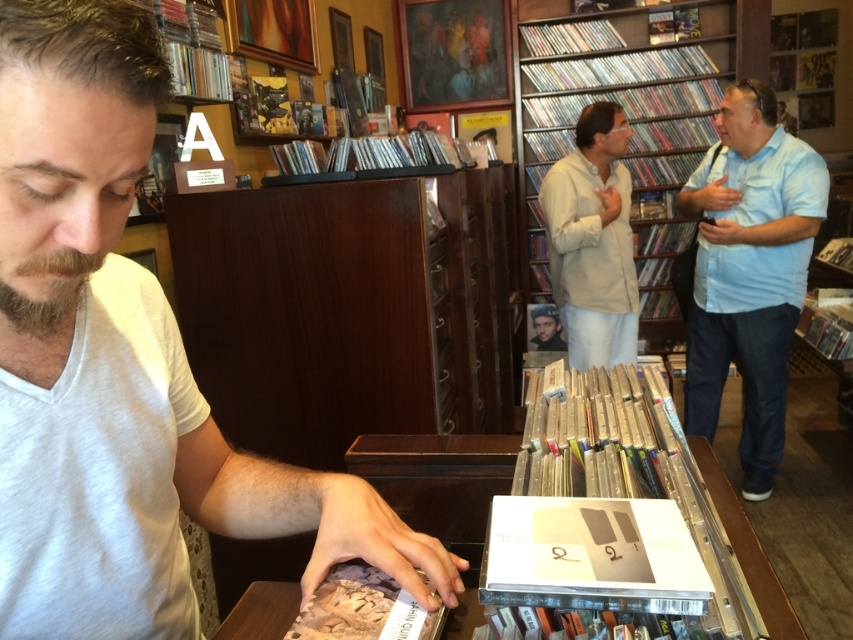
Can you confirm if light blue shirt at right is thinner than brown fuzzy beard at lower left?

No.

Is light blue shirt at right above brown fuzzy beard at lower left?

Correct, light blue shirt at right is located above brown fuzzy beard at lower left.

This screenshot has width=853, height=640. Describe the element at coordinates (749, 272) in the screenshot. I see `light blue shirt at right` at that location.

Find the location of a particular element. light blue shirt at right is located at coordinates (749, 272).

Does white matte shirt at center have a greater height compared to wooden textured book at center?

Correct, white matte shirt at center is much taller as wooden textured book at center.

Is white matte shirt at center smaller than wooden textured book at center?

Incorrect, white matte shirt at center is not smaller in size than wooden textured book at center.

What do you see at coordinates (141, 348) in the screenshot? This screenshot has width=853, height=640. I see `white matte shirt at center` at bounding box center [141, 348].

Identify the location of white matte shirt at center. The width and height of the screenshot is (853, 640). [141, 348].

Is light blue shirt at right bigger than wooden textured book at center?

Correct, light blue shirt at right is larger in size than wooden textured book at center.

Is point (810, 161) closer to viewer compared to point (378, 600)?

No, (810, 161) is behind (378, 600).

Is point (802, 252) less distant than point (419, 605)?

No.

This screenshot has height=640, width=853. I want to click on light blue shirt at right, so click(x=749, y=272).